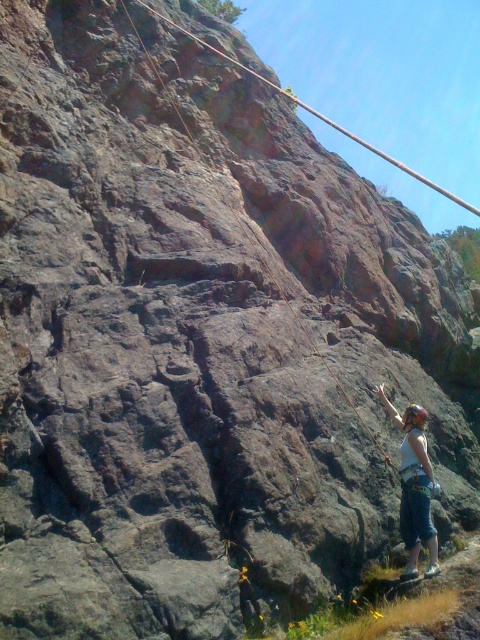
Who is positioned more to the left, white fabric helmet at right or rusty rock climbing hold at center?

rusty rock climbing hold at center is more to the left.

Is point (432, 557) positioned before point (309, 337)?

Yes, point (432, 557) is in front of point (309, 337).

Who is more distant from viewer, (422, 506) or (134, 32)?

The point (134, 32) is behind.

Locate an element on the screen. white fabric helmet at right is located at coordinates (415, 486).